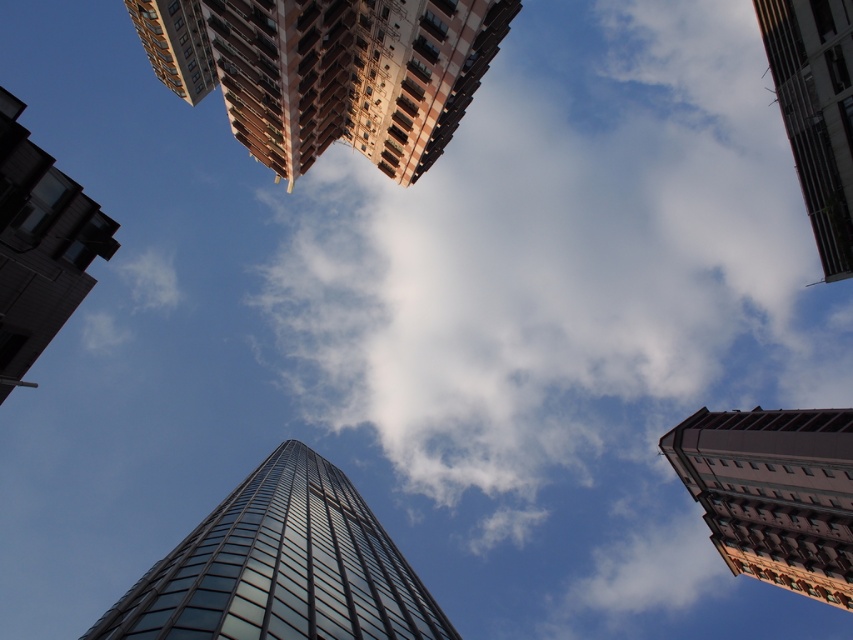
Find the location of a particular element. This screenshot has width=853, height=640. transparent glass tower at center is located at coordinates (281, 566).

Describe the element at coordinates (281, 566) in the screenshot. The image size is (853, 640). I see `transparent glass tower at center` at that location.

This screenshot has width=853, height=640. What are the coordinates of `transparent glass tower at center` in the screenshot? It's located at (281, 566).

Does brown textured building at right appear under glassy reflective building at left?

Indeed, brown textured building at right is positioned under glassy reflective building at left.

This screenshot has height=640, width=853. I want to click on brown textured building at right, so click(x=775, y=492).

You are a GUI agent. You are given a task and a screenshot of the screen. Output one action in this format:
    pyautogui.click(x=<x>, y=<y>)
    Task: Click on the brown textured building at right
    Image resolution: width=853 pixels, height=640 pixels.
    Given the screenshot: What is the action you would take?
    pyautogui.click(x=775, y=492)

Is glassy reflective building at left bigger than metallic glass skyscraper at upper right?

Correct, glassy reflective building at left is larger in size than metallic glass skyscraper at upper right.

Is point (10, 131) closer to camera compared to point (798, 164)?

Yes, it is.

At what (x,y) coordinates should I click in order to perform the action: click on glassy reflective building at left. Please return your answer as a coordinate pair (x, y). The image size is (853, 640). Looking at the image, I should click on (39, 246).